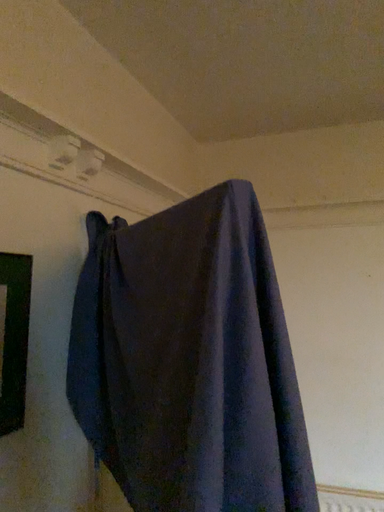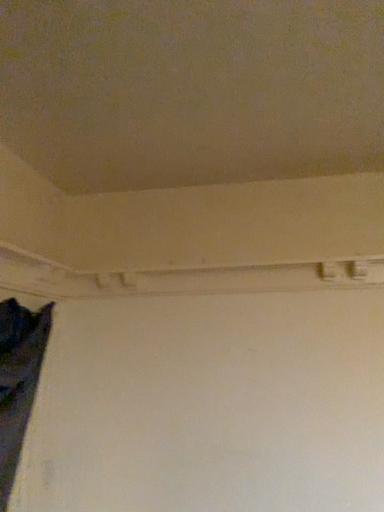
Question: How did the camera likely rotate when shooting the video?

Choices:
 (A) rotated left
 (B) rotated right

Answer: (B)